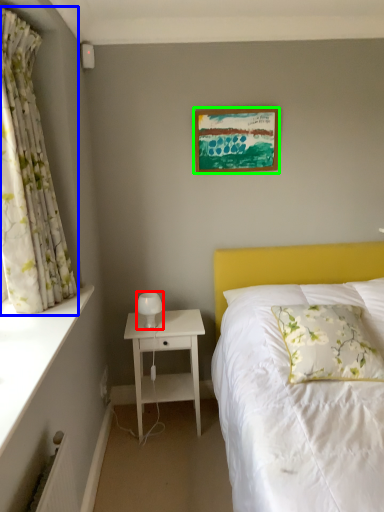
Question: Which object is positioned closest to table lamp (highlighted by a red box)? Select from curtain (highlighted by a blue box) and picture frame (highlighted by a green box).

Choices:
 (A) curtain
 (B) picture frame

Answer: (A)